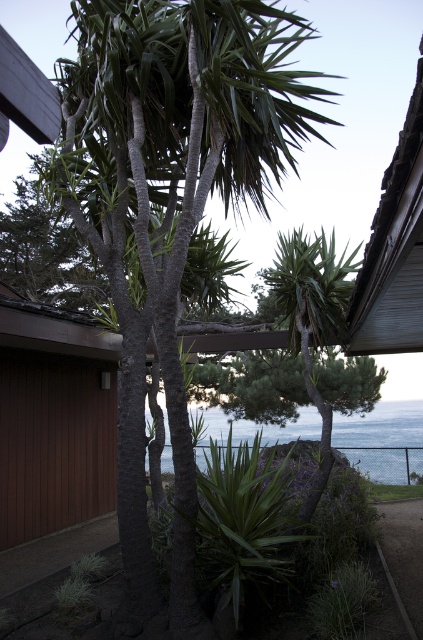
Does green textured palm tree at center appear on the left side of blue water at center?

Yes, green textured palm tree at center is to the left of blue water at center.

Between green textured palm tree at center and blue water at center, which one appears on the left side from the viewer's perspective?

From the viewer's perspective, green textured palm tree at center appears more on the left side.

Is point (126, 45) less distant than point (224, 417)?

Yes, point (126, 45) is closer to viewer.

Identify the location of green textured palm tree at center. pos(189,163).